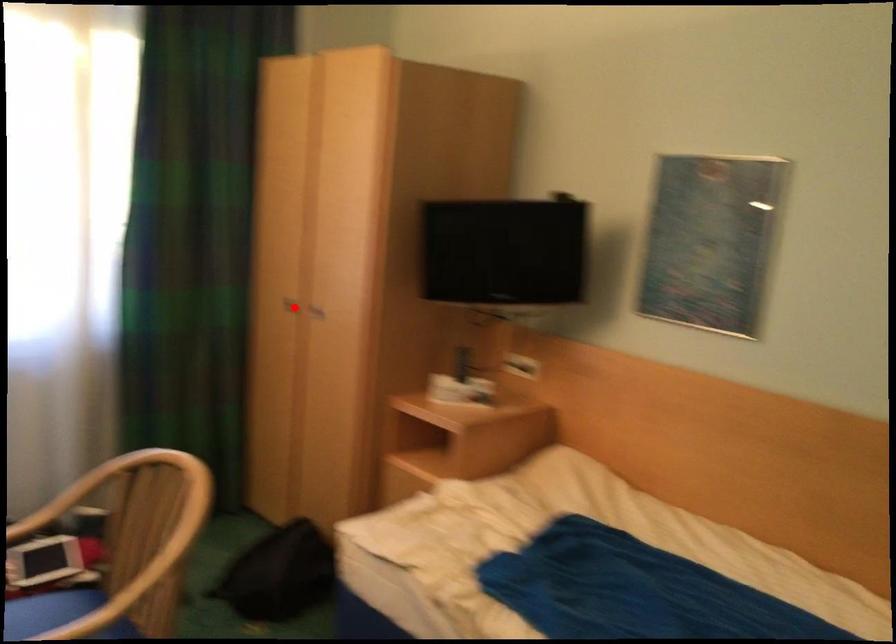
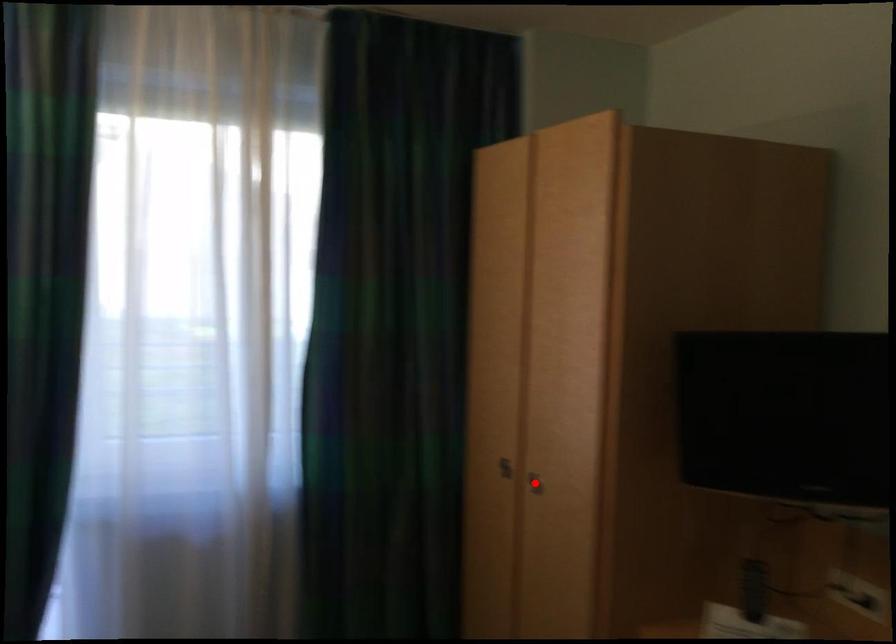
I am providing you with two images of the same scene from different viewpoints. A red point is marked on the first image and another point is marked on the second image. Are the points marked in image1 and image2 representing the same 3D position?

No